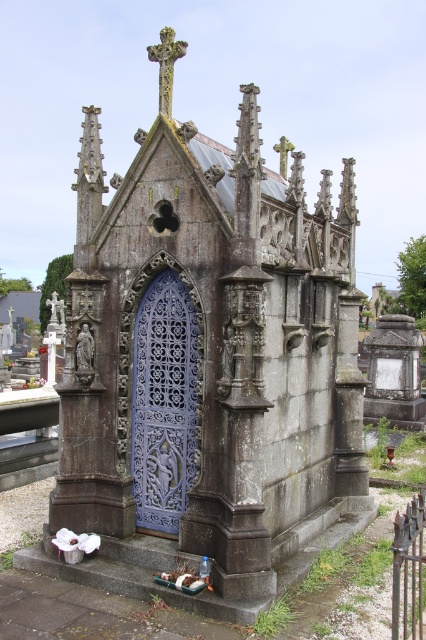
Can you confirm if rusty stone mausoleum at center is shorter than blue metallic door at center?

No, rusty stone mausoleum at center is not shorter than blue metallic door at center.

What do you see at coordinates (207, 364) in the screenshot? The height and width of the screenshot is (640, 426). I see `rusty stone mausoleum at center` at bounding box center [207, 364].

Is point (259, 435) less distant than point (189, 323)?

Yes, point (259, 435) is closer to viewer.

What are the coordinates of `rusty stone mausoleum at center` in the screenshot? It's located at (207, 364).